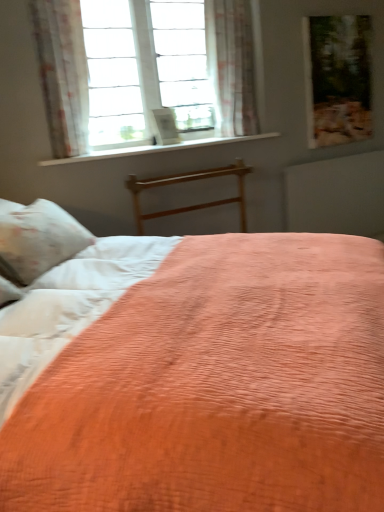
Question: Is floral sheer curtain at upper left, which is the 1th curtain in left-to-right order, turned away from wooden bed frame at center?

Choices:
 (A) yes
 (B) no

Answer: (B)

Question: Considering the relative positions of floral sheer curtain at upper left, which is counted as the second curtain, starting from the back, and wooden bed frame at center in the image provided, is floral sheer curtain at upper left, which is counted as the second curtain, starting from the back, to the right of wooden bed frame at center from the viewer's perspective?

Choices:
 (A) no
 (B) yes

Answer: (A)

Question: Does floral sheer curtain at upper left, which is the 2th curtain in right-to-left order, contain wooden bed frame at center?

Choices:
 (A) no
 (B) yes

Answer: (A)

Question: Is there a large distance between floral sheer curtain at upper left, which is the first curtain from front to back, and wooden bed frame at center?

Choices:
 (A) no
 (B) yes

Answer: (A)

Question: Is floral sheer curtain at upper left, which is the 2th curtain in right-to-left order, oriented towards wooden bed frame at center?

Choices:
 (A) no
 (B) yes

Answer: (A)

Question: Does floral sheer curtain at upper left, which is the 1th curtain in left-to-right order, have a lesser height compared to wooden bed frame at center?

Choices:
 (A) yes
 (B) no

Answer: (B)

Question: From the image's perspective, is white smooth window sill at upper center located beneath sheer floral fabric at upper center, placed as the 1th curtain when sorted from back to front?

Choices:
 (A) yes
 (B) no

Answer: (A)

Question: Can we say white smooth window sill at upper center lies outside sheer floral fabric at upper center, placed as the 1th curtain when sorted from back to front?

Choices:
 (A) no
 (B) yes

Answer: (B)

Question: Is white smooth window sill at upper center taller than sheer floral fabric at upper center, marked as the 2th curtain in a front-to-back arrangement?

Choices:
 (A) no
 (B) yes

Answer: (A)

Question: Is sheer floral fabric at upper center, which is counted as the 2th curtain, starting from the left, completely or partially inside white smooth window sill at upper center?

Choices:
 (A) no
 (B) yes

Answer: (A)

Question: From a real-world perspective, is white smooth window sill at upper center below sheer floral fabric at upper center, marked as the 2th curtain in a front-to-back arrangement?

Choices:
 (A) no
 (B) yes

Answer: (B)

Question: Is white smooth window sill at upper center facing away from sheer floral fabric at upper center, placed as the 1th curtain when sorted from back to front?

Choices:
 (A) no
 (B) yes

Answer: (A)

Question: Is wooden picture frame at upper right turned away from coral quilted bed at center?

Choices:
 (A) no
 (B) yes

Answer: (A)